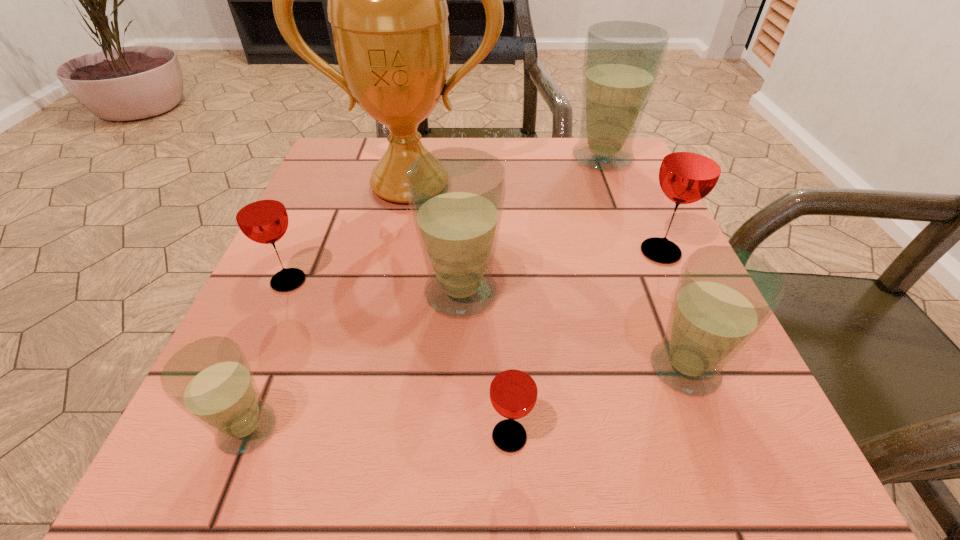
The image size is (960, 540). I want to click on object that is the seventh closest to the leftmost blue glass, so click(x=622, y=59).

Identify which object is located as the second nearest to the biggest red glass. Please provide its 2D coordinates. Your answer should be formatted as a tuple, i.e. [(x, y)], where the tuple contains the x and y coordinates of a point satisfying the conditions above.

[(622, 59)]

Locate which glass is the third closest to the third biggest blue glass. Please provide its 2D coordinates. Your answer should be formatted as a tuple, i.e. [(x, y)], where the tuple contains the x and y coordinates of a point satisfying the conditions above.

[(456, 195)]

Identify the location of glass that stands as the fifth closest to the second farthest blue glass. (692, 164).

You are a GUI agent. You are given a task and a screenshot of the screen. Output one action in this format:
    pyautogui.click(x=<x>, y=<y>)
    Task: Click on the closest blue glass to the nearest red glass
    The height and width of the screenshot is (540, 960).
    Given the screenshot: What is the action you would take?
    pyautogui.click(x=456, y=195)

Select which blue glass is the closest to the smallest red glass. Please provide its 2D coordinates. Your answer should be formatted as a tuple, i.e. [(x, y)], where the tuple contains the x and y coordinates of a point satisfying the conditions above.

[(456, 195)]

This screenshot has width=960, height=540. Identify the location of red glass that is the second closest to the second biggest blue glass. click(260, 213).

Find the location of a particular element. the closest red glass to the smallest red glass is located at coordinates (692, 164).

The width and height of the screenshot is (960, 540). I want to click on free region that satisfies the following two spatial constraints: 1. on the back side of the leftmost red glass; 2. on the left side of the farthest blue glass, so click(x=344, y=158).

You are a GUI agent. You are given a task and a screenshot of the screen. Output one action in this format:
    pyautogui.click(x=<x>, y=<y>)
    Task: Click on the vacant area that satisfies the following two spatial constraints: 1. on the front of the award with the decoration; 2. on the right side of the third biggest blue glass
    This screenshot has height=540, width=960.
    Given the screenshot: What is the action you would take?
    pyautogui.click(x=372, y=368)